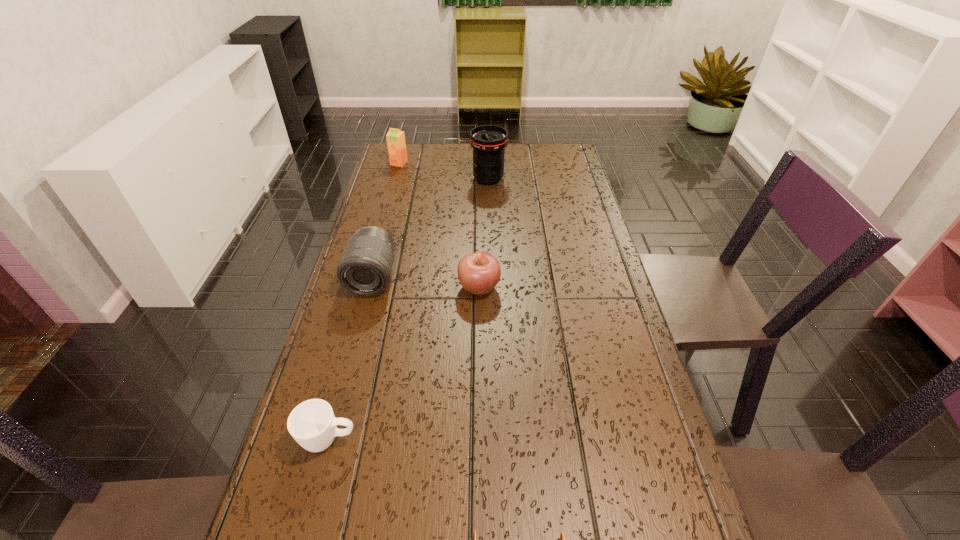
Identify the location of free location located 0.370m on the surface of the shorter telephoto lens. (333, 428).

You are a GUI agent. You are given a task and a screenshot of the screen. Output one action in this format:
    pyautogui.click(x=<x>, y=<y>)
    Task: Click on the vacant space situated 0.150m on the side of the apple with the unique marking
    The image size is (960, 540).
    Given the screenshot: What is the action you would take?
    pyautogui.click(x=555, y=287)

Identify the location of vacant space situated 0.300m with the handle on the side of the fifth tallest object. (508, 440).

You are a GUI agent. You are given a task and a screenshot of the screen. Output one action in this format:
    pyautogui.click(x=<x>, y=<y>)
    Task: Click on the telephoto lens situated at the far edge
    The width and height of the screenshot is (960, 540).
    Given the screenshot: What is the action you would take?
    pyautogui.click(x=488, y=141)

Locate an element on the screen. Image resolution: width=960 pixels, height=540 pixels. orange juice at the far edge is located at coordinates (396, 144).

I want to click on orange juice that is at the left edge, so click(x=396, y=144).

The height and width of the screenshot is (540, 960). What are the coordinates of `telephoto lens that is positioned at the left edge` in the screenshot? It's located at (365, 268).

Identify the location of cup at the left edge. Image resolution: width=960 pixels, height=540 pixels. [312, 424].

Where is `object that is positioned at the far left corner`? The image size is (960, 540). object that is positioned at the far left corner is located at coordinates (396, 144).

Where is `free space at the far edge of the desktop`? The image size is (960, 540). free space at the far edge of the desktop is located at coordinates (513, 167).